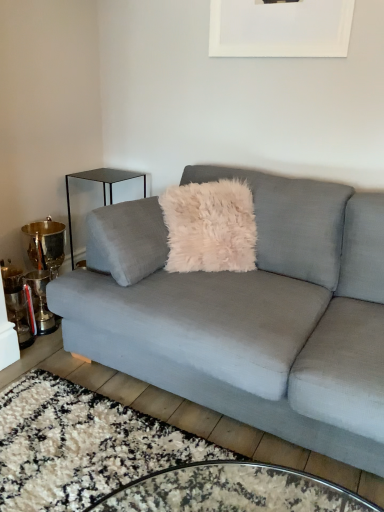
Question: Is velvet gray couch at center wider or thinner than black glass side table at left?

Choices:
 (A) thin
 (B) wide

Answer: (B)

Question: Is point (140, 289) closer or farther from the camera than point (130, 174)?

Choices:
 (A) farther
 (B) closer

Answer: (B)

Question: Based on their relative distances, which object is nearer to the velvet gray couch at center?

Choices:
 (A) black glass side table at left
 (B) white matte picture frame at upper center

Answer: (B)

Question: Estimate the real-world distances between objects in this image. Which object is closer to the velvet gray couch at center?

Choices:
 (A) black glass side table at left
 (B) white matte picture frame at upper center

Answer: (B)